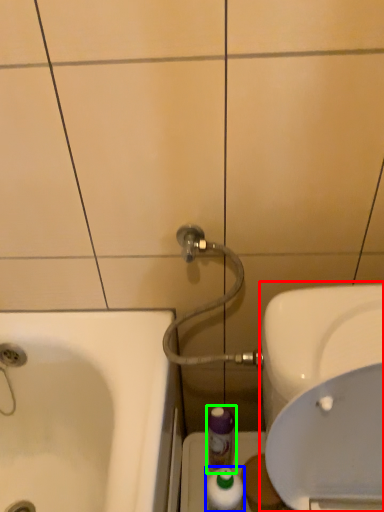
Question: Based on their relative distances, which object is farther from sink (highlighted by a red box)? Choose from mouthwash (highlighted by a blue box) and mouthwash (highlighted by a green box).

Choices:
 (A) mouthwash
 (B) mouthwash

Answer: (A)